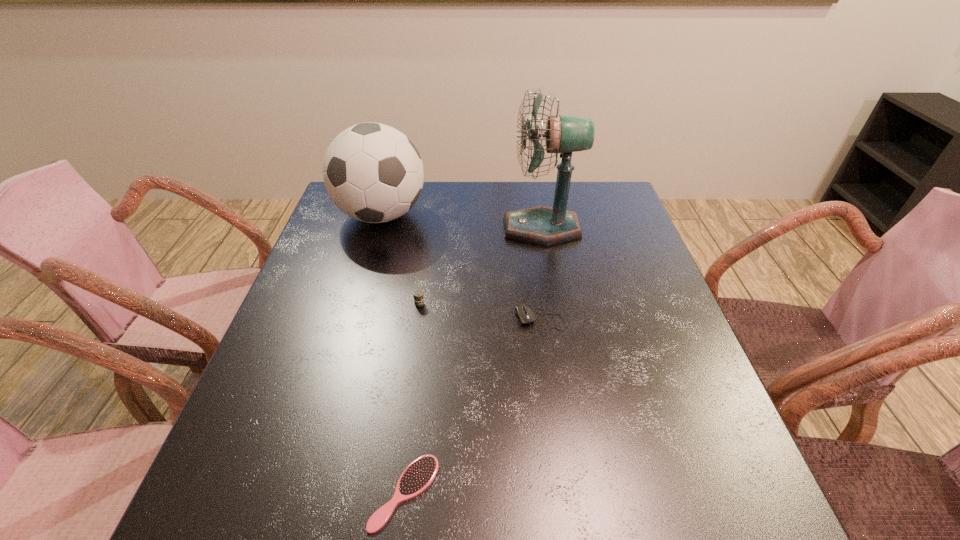
Where is `vacant space that satisfies the following two spatial constraints: 1. on the front side of the soccer ball; 2. on the left side of the fourth tallest object`? The image size is (960, 540). vacant space that satisfies the following two spatial constraints: 1. on the front side of the soccer ball; 2. on the left side of the fourth tallest object is located at coordinates (350, 321).